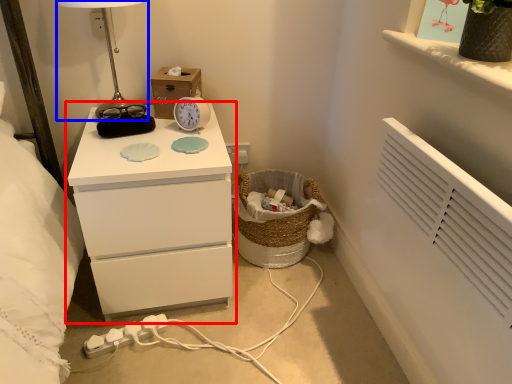
Question: Which point is further to the camera, chest of drawers (highlighted by a red box) or table lamp (highlighted by a blue box)?

Choices:
 (A) chest of drawers
 (B) table lamp

Answer: (B)